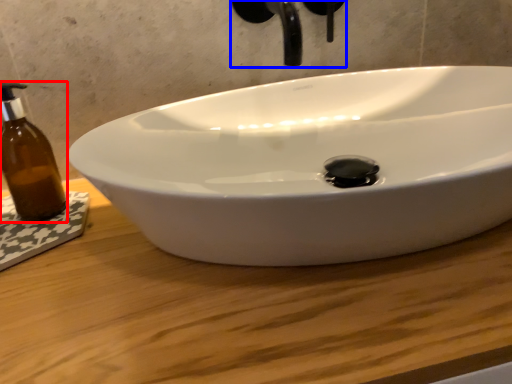
Question: Which of the following is the closest to the observer, bottle (highlighted by a red box) or plumbing fixture (highlighted by a blue box)?

Choices:
 (A) bottle
 (B) plumbing fixture

Answer: (B)